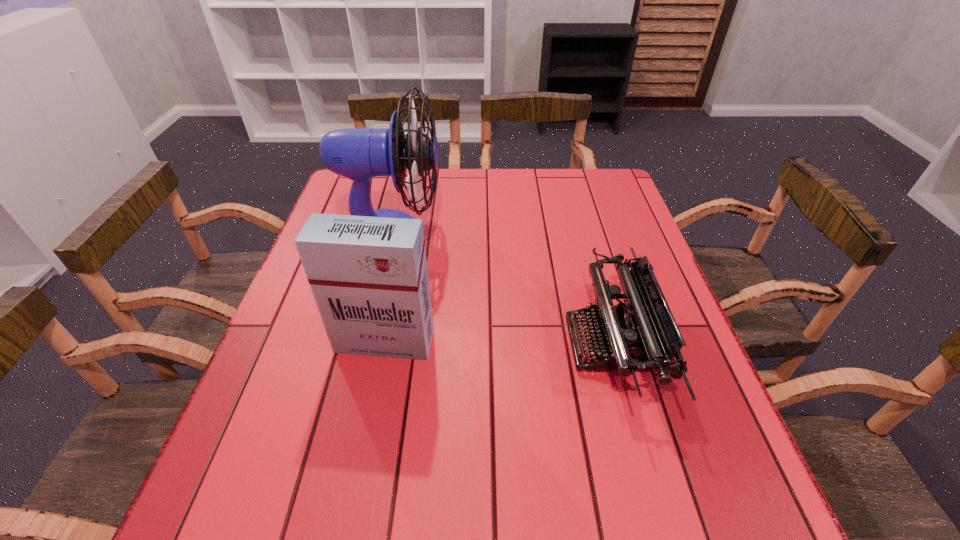
Image resolution: width=960 pixels, height=540 pixels. Identify the location of object located at the far edge. (359, 154).

Where is `fan that is at the left edge`? fan that is at the left edge is located at coordinates (359, 154).

Where is `cigarette case that is positioned at the left edge`? This screenshot has width=960, height=540. cigarette case that is positioned at the left edge is located at coordinates (368, 275).

I want to click on object located at the right edge, so click(642, 335).

The height and width of the screenshot is (540, 960). I want to click on object situated at the far left corner, so click(359, 154).

Locate an element on the screen. This screenshot has width=960, height=540. vacant space at the far edge is located at coordinates (456, 183).

In the image, there is a desktop. At what (x,y) coordinates should I click in order to perform the action: click on vacant space at the left edge. Please return your answer as a coordinate pair (x, y). The height and width of the screenshot is (540, 960). Looking at the image, I should click on (287, 424).

What are the coordinates of `free space at the right edge` in the screenshot? It's located at (686, 373).

Image resolution: width=960 pixels, height=540 pixels. What are the coordinates of `free space at the near left corner` in the screenshot? It's located at (245, 509).

I want to click on vacant region at the far right corner, so [627, 206].